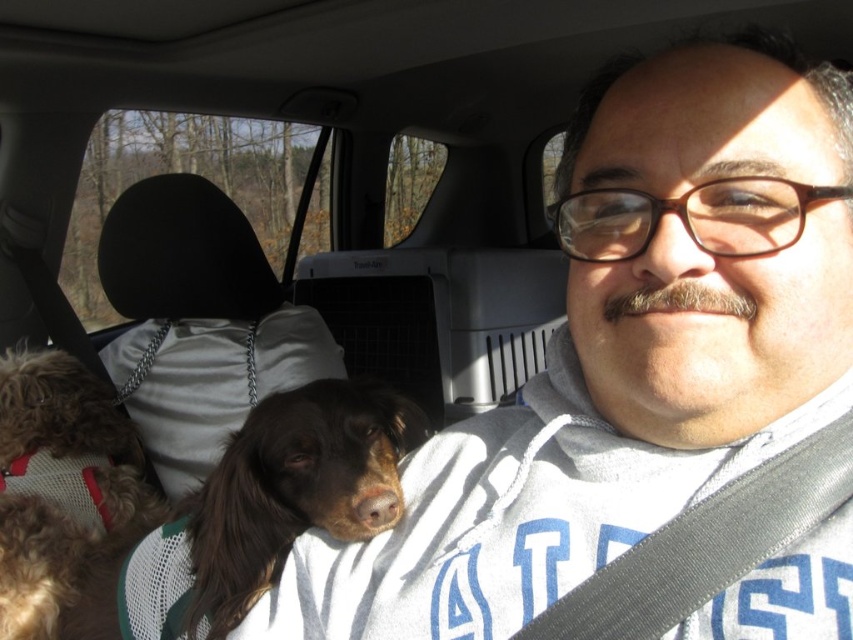
What do you see at coordinates (294, 488) in the screenshot? I see `brown fur dog at center` at bounding box center [294, 488].

In the scene shown: Measure the distance from brown fur dog at center to fuzzy brown dog at left.

A distance of 24.63 inches exists between brown fur dog at center and fuzzy brown dog at left.

Is point (389, 525) in front of point (41, 490)?

Yes, it is.

Where is `brown fur dog at center`? brown fur dog at center is located at coordinates (294, 488).